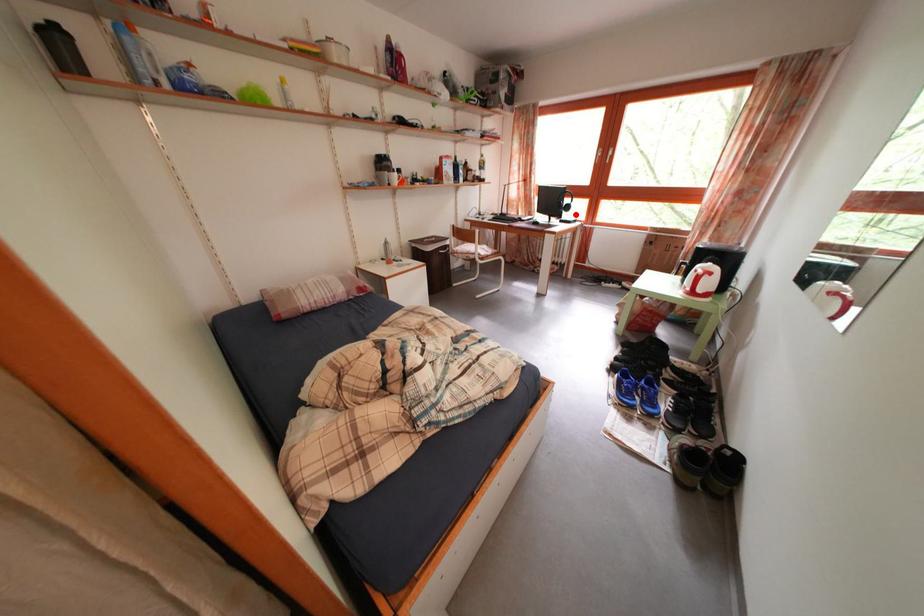
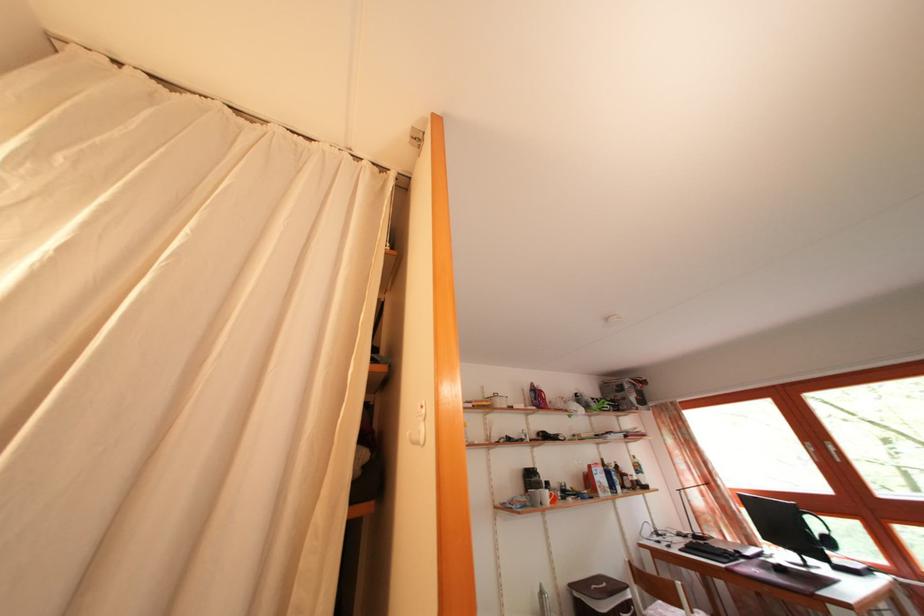
Find the pixel in the second image that matches the highlighted location in the first image.

(837, 549)